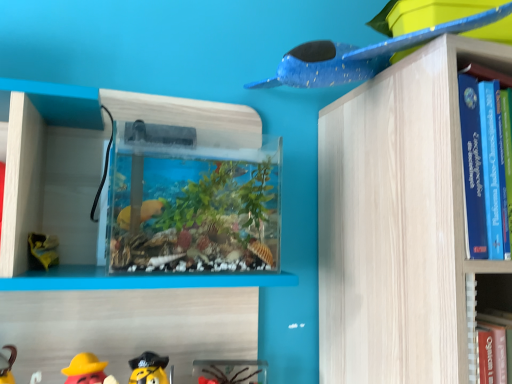
Question: Can you confirm if rubber duck at lower left, the 3th toy positioned from the right, is thinner than blue speckled plastic airplane at upper right, the 1th toy when ordered from top to bottom?

Choices:
 (A) no
 (B) yes

Answer: (B)

Question: From the image's perspective, is rubber duck at lower left, the 3th toy positioned from the right, on blue speckled plastic airplane at upper right, which is the 3th toy in bottom-to-top order?

Choices:
 (A) no
 (B) yes

Answer: (A)

Question: Can you confirm if rubber duck at lower left, the 3th toy positioned from the right, is bigger than blue speckled plastic airplane at upper right, which is the 3th toy in bottom-to-top order?

Choices:
 (A) yes
 (B) no

Answer: (B)

Question: Is rubber duck at lower left, which is counted as the 2th toy, starting from the bottom, outside of blue speckled plastic airplane at upper right, the 1th toy positioned from the right?

Choices:
 (A) no
 (B) yes

Answer: (B)

Question: Is rubber duck at lower left, the 1th toy positioned from the left, taller than blue speckled plastic airplane at upper right, acting as the third toy starting from the left?

Choices:
 (A) no
 (B) yes

Answer: (A)

Question: Which is correct: translucent plastic toy at lower center, acting as the 1th toy starting from the bottom, is inside rubber duck at lower left, the 3th toy positioned from the right, or outside of it?

Choices:
 (A) outside
 (B) inside

Answer: (A)

Question: From a real-world perspective, relative to rubber duck at lower left, the 1th toy positioned from the left, is translucent plastic toy at lower center, positioned as the second toy in right-to-left order, vertically above or below?

Choices:
 (A) below
 (B) above

Answer: (A)

Question: In terms of width, does translucent plastic toy at lower center, acting as the 1th toy starting from the bottom, look wider or thinner when compared to rubber duck at lower left, which is counted as the 2th toy, starting from the bottom?

Choices:
 (A) thin
 (B) wide

Answer: (B)

Question: Does point (205, 372) appear closer or farther from the camera than point (86, 374)?

Choices:
 (A) farther
 (B) closer

Answer: (A)

Question: From a real-world perspective, relative to translucent plastic toy at lower center, acting as the 1th toy starting from the bottom, is rubber duck at lower left, the 1th toy positioned from the left, vertically above or below?

Choices:
 (A) below
 (B) above

Answer: (B)

Question: Is point (80, 360) closer or farther from the camera than point (225, 377)?

Choices:
 (A) closer
 (B) farther

Answer: (A)

Question: Looking at their shapes, would you say rubber duck at lower left, the 3th toy positioned from the right, is wider or thinner than translucent plastic toy at lower center, which is the 2th toy in left-to-right order?

Choices:
 (A) wide
 (B) thin

Answer: (B)

Question: Is rubber duck at lower left, the 3th toy positioned from the right, inside or outside of translucent plastic toy at lower center, acting as the 1th toy starting from the bottom?

Choices:
 (A) inside
 (B) outside

Answer: (B)

Question: Considering their positions, is blue speckled plastic airplane at upper right, the 1th toy when ordered from top to bottom, located in front of or behind rubber duck at lower left, the 1th toy positioned from the left?

Choices:
 (A) front
 (B) behind

Answer: (A)

Question: In terms of width, does blue speckled plastic airplane at upper right, acting as the third toy starting from the left, look wider or thinner when compared to rubber duck at lower left, the 1th toy positioned from the left?

Choices:
 (A) wide
 (B) thin

Answer: (A)